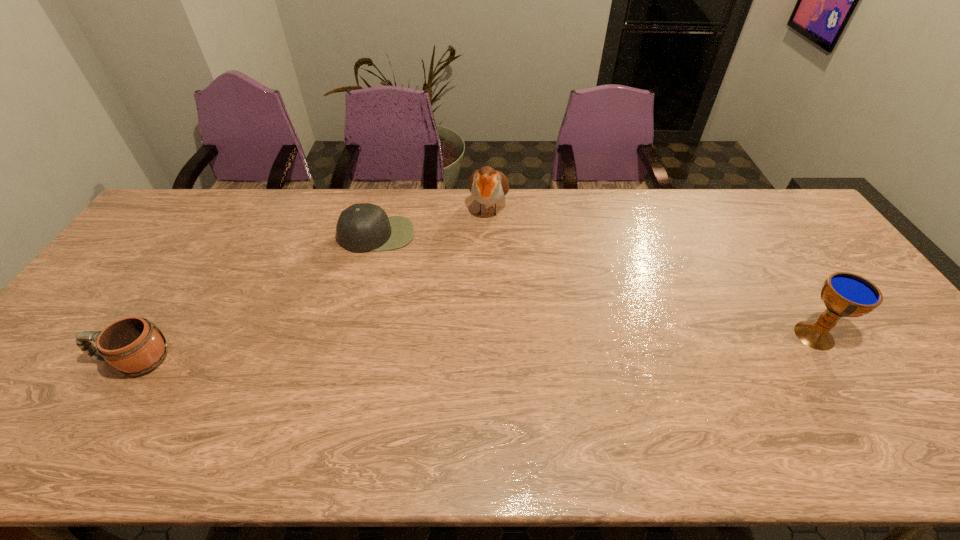
Identify the location of empty space that is in between the third object from right to left and the mug. The width and height of the screenshot is (960, 540). (255, 297).

Where is `empty space that is in between the bird and the rightmost object`? empty space that is in between the bird and the rightmost object is located at coordinates (651, 272).

The image size is (960, 540). What are the coordinates of `free space that is in between the rightmost object and the mug` in the screenshot? It's located at (473, 348).

I want to click on vacant area between the bird and the rightmost object, so click(651, 272).

At what (x,y) coordinates should I click in order to perform the action: click on vacant point located between the bird and the mug. Please return your answer as a coordinate pair (x, y). Looking at the image, I should click on tap(310, 284).

Identify the location of vacant point located between the third object from right to left and the rightmost object. The width and height of the screenshot is (960, 540). (596, 285).

In order to click on free space between the cap and the leftmost object in this screenshot , I will do `click(255, 297)`.

Where is `vacant area that lies between the chalice and the mug`? vacant area that lies between the chalice and the mug is located at coordinates (473, 348).

Where is `free area in between the bird and the third object from right to left`? Image resolution: width=960 pixels, height=540 pixels. free area in between the bird and the third object from right to left is located at coordinates pyautogui.click(x=433, y=221).

At what (x,y) coordinates should I click in order to perform the action: click on free space between the third object from right to left and the third object from left to right. Please return your answer as a coordinate pair (x, y). Image resolution: width=960 pixels, height=540 pixels. Looking at the image, I should click on (433, 221).